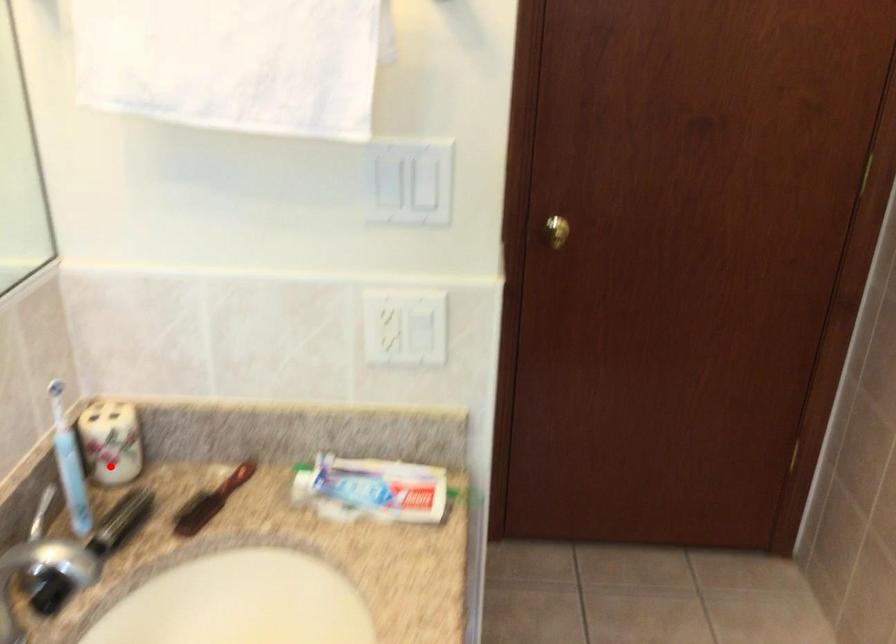
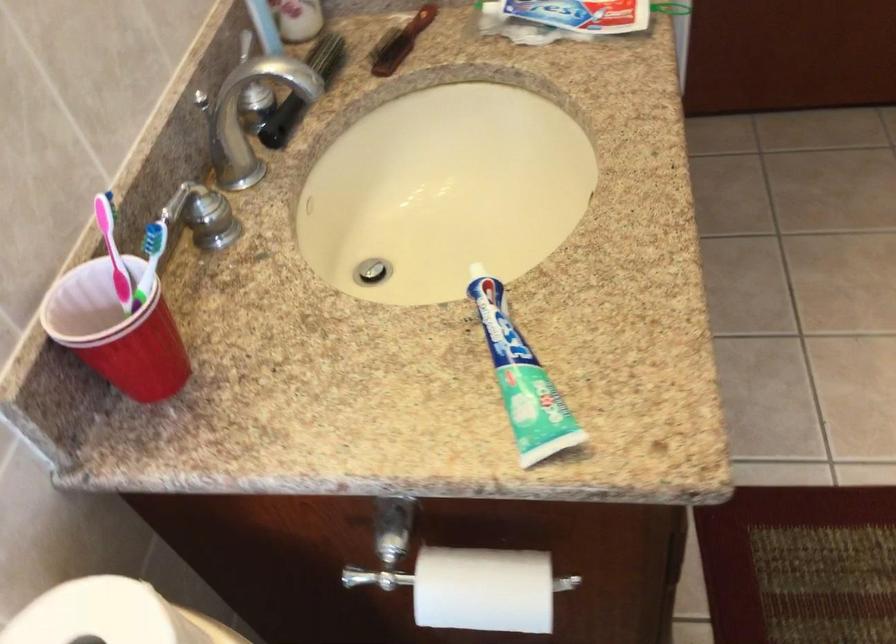
The point at the highlighted location is marked in the first image. Where is the corresponding point in the second image?

(297, 19)